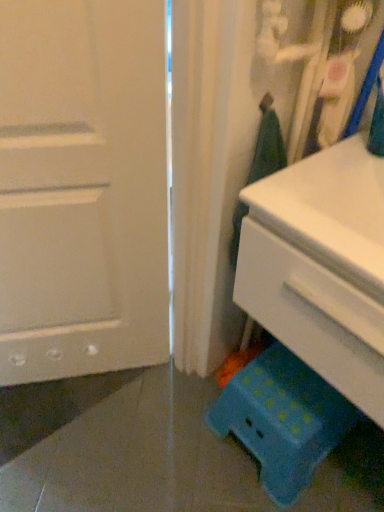
Describe the element at coordinates (82, 188) in the screenshot. The image size is (384, 512). I see `white matte door at left` at that location.

What do you see at coordinates (321, 267) in the screenshot? I see `white plastic chest of drawers at lower right` at bounding box center [321, 267].

This screenshot has width=384, height=512. In order to click on white plastic chest of drawers at lower right in this screenshot , I will do `click(321, 267)`.

This screenshot has height=512, width=384. What do you see at coordinates (377, 122) in the screenshot?
I see `teal plastic stool at lower right` at bounding box center [377, 122].

Where is `white matte door at left`? The width and height of the screenshot is (384, 512). white matte door at left is located at coordinates (82, 188).

From a real-world perspective, is teal plastic stool at lower right physically above white plastic chest of drawers at lower right?

Yes, from a real-world perspective, teal plastic stool at lower right is on top of white plastic chest of drawers at lower right.

This screenshot has width=384, height=512. Identify the location of teal behind the white plastic chest of drawers at lower right. (377, 122).

From the image's perspective, is teal plastic stool at lower right over white plastic chest of drawers at lower right?

Correct, teal plastic stool at lower right appears higher than white plastic chest of drawers at lower right in the image.

Is point (381, 79) farther from viewer compared to point (357, 268)?

Yes.

Image resolution: width=384 pixels, height=512 pixels. I want to click on step stool on the left of the white plastic chest of drawers at lower right, so click(x=282, y=419).

Can you confirm if blue polka dot plastic stool at lower right is positioned to the right of white plastic chest of drawers at lower right?

No.

Who is shorter, blue polka dot plastic stool at lower right or white plastic chest of drawers at lower right?

With less height is blue polka dot plastic stool at lower right.

Considering the sizes of blue polka dot plastic stool at lower right and white plastic chest of drawers at lower right in the image, is blue polka dot plastic stool at lower right bigger or smaller than white plastic chest of drawers at lower right?

blue polka dot plastic stool at lower right is smaller than white plastic chest of drawers at lower right.

Between point (145, 12) and point (269, 423), which one is positioned behind?

The point (269, 423) is behind.

Does white matte door at left have a greater height compared to blue polka dot plastic stool at lower right?

Yes.

Is white matte door at left wider or thinner than blue polka dot plastic stool at lower right?

Considering their sizes, white matte door at left looks slimmer than blue polka dot plastic stool at lower right.

Is white matte door at left next to blue polka dot plastic stool at lower right?

No, white matte door at left is not making contact with blue polka dot plastic stool at lower right.

How many degrees apart are the facing directions of blue polka dot plastic stool at lower right and teal plastic stool at lower right?

They differ by 13.1 degrees in their facing directions.

From a real-world perspective, which is physically above, blue polka dot plastic stool at lower right or teal plastic stool at lower right?

In real-world perspective, teal plastic stool at lower right is above.

Are blue polka dot plastic stool at lower right and teal plastic stool at lower right located far from each other?

No, there isn't a large distance between blue polka dot plastic stool at lower right and teal plastic stool at lower right.

Which point is more forward, (232, 413) or (377, 108)?

Point (377, 108)

Does teal plastic stool at lower right appear on the left side of white matte door at left?

In fact, teal plastic stool at lower right is to the right of white matte door at left.

Is teal plastic stool at lower right outside of white matte door at left?

Yes, teal plastic stool at lower right is outside of white matte door at left.

From the image's perspective, would you say teal plastic stool at lower right is shown under white matte door at left?

No, from the image's perspective, teal plastic stool at lower right is not below white matte door at left.

How much distance is there between teal plastic stool at lower right and white matte door at left?

teal plastic stool at lower right is 26.88 inches away from white matte door at left.

Is white matte door at left positioned with its back to white plastic chest of drawers at lower right?

No.

I want to click on the chest of drawers that is above the white matte door at left (from a real-world perspective), so tap(321, 267).

Based on the photo, who is smaller, white matte door at left or white plastic chest of drawers at lower right?

white plastic chest of drawers at lower right is smaller.

Is white plastic chest of drawers at lower right to the right of white matte door at left from the viewer's perspective?

Correct, you'll find white plastic chest of drawers at lower right to the right of white matte door at left.

Based on the photo, between white plastic chest of drawers at lower right and white matte door at left, which one has smaller width?

With smaller width is white matte door at left.

Which point is more distant from viewer, (x=342, y=329) or (x=129, y=357)?

The point (x=129, y=357) is farther from the camera.

The width and height of the screenshot is (384, 512). Find the location of `the chest of drawers lying in front of the teal plastic stool at lower right`. the chest of drawers lying in front of the teal plastic stool at lower right is located at coordinates (321, 267).

You are a GUI agent. You are given a task and a screenshot of the screen. Output one action in this format:
    pyautogui.click(x=<x>, y=<y>)
    Task: Click on the step stool below the white plastic chest of drawers at lower right (from a real-world perspective)
    
    Given the screenshot: What is the action you would take?
    pyautogui.click(x=282, y=419)

From the image, which object appears to be farther from white plastic chest of drawers at lower right, white matte door at left or blue polka dot plastic stool at lower right?

blue polka dot plastic stool at lower right.

Estimate the real-world distances between objects in this image. Which object is further from teal plastic stool at lower right, white plastic chest of drawers at lower right or blue polka dot plastic stool at lower right?

The object further to teal plastic stool at lower right is blue polka dot plastic stool at lower right.

Which object lies nearer to the anchor point teal plastic stool at lower right, blue polka dot plastic stool at lower right or white matte door at left?

Based on the image, white matte door at left appears to be nearer to teal plastic stool at lower right.

When comparing their distances from white matte door at left, does blue polka dot plastic stool at lower right or teal plastic stool at lower right seem further?

teal plastic stool at lower right is further to white matte door at left.

Based on their spatial positions, is teal plastic stool at lower right or blue polka dot plastic stool at lower right closer to white plastic chest of drawers at lower right?

Among the two, teal plastic stool at lower right is located nearer to white plastic chest of drawers at lower right.

Which object lies nearer to the anchor point blue polka dot plastic stool at lower right, teal plastic stool at lower right or white plastic chest of drawers at lower right?

Among the two, white plastic chest of drawers at lower right is located nearer to blue polka dot plastic stool at lower right.

Estimate the real-world distances between objects in this image. Which object is further from white matte door at left, blue polka dot plastic stool at lower right or white plastic chest of drawers at lower right?

blue polka dot plastic stool at lower right is positioned further to the anchor white matte door at left.

Considering their positions, is white plastic chest of drawers at lower right positioned further to teal plastic stool at lower right than white matte door at left?

white matte door at left is positioned further to the anchor teal plastic stool at lower right.

Identify the location of step stool between white matte door at left and teal plastic stool at lower right in the horizontal direction. This screenshot has width=384, height=512. (282, 419).

Identify the location of the chest of drawers that lies between teal plastic stool at lower right and blue polka dot plastic stool at lower right from top to bottom. The height and width of the screenshot is (512, 384). (321, 267).

Identify the location of the chest of drawers situated between white matte door at left and teal plastic stool at lower right from left to right. (321, 267).

Locate an element on the screen. The width and height of the screenshot is (384, 512). step stool between white matte door at left and white plastic chest of drawers at lower right from left to right is located at coordinates (282, 419).